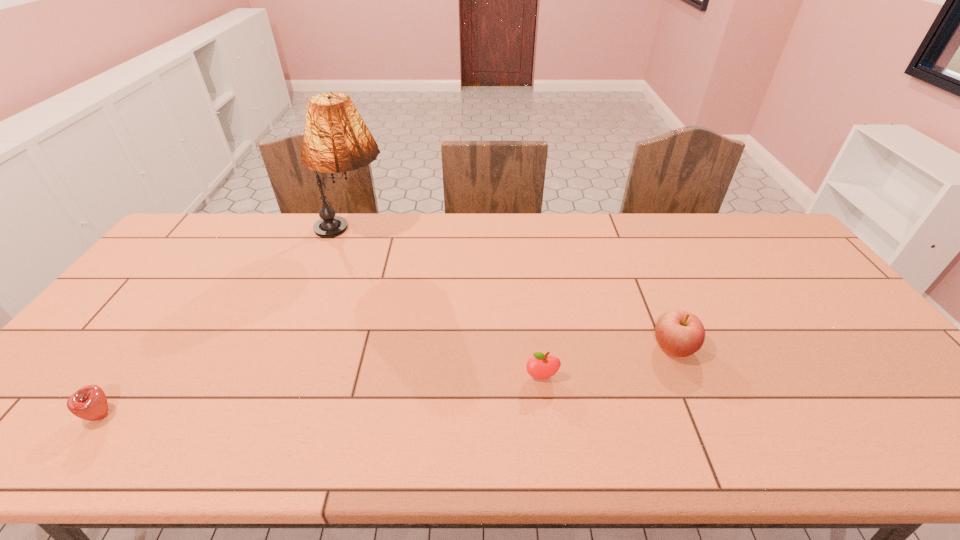
The width and height of the screenshot is (960, 540). I want to click on blank area located on the back of the second apple from left to right, so click(x=536, y=329).

I want to click on free space located on the back of the nearest object, so click(126, 381).

This screenshot has height=540, width=960. I want to click on object located in the far edge section of the desktop, so [336, 139].

I want to click on object located at the near edge, so click(90, 403).

The image size is (960, 540). What are the coordinates of `object present at the left edge` in the screenshot? It's located at (90, 403).

This screenshot has width=960, height=540. I want to click on object located at the near left corner, so click(x=90, y=403).

The height and width of the screenshot is (540, 960). I want to click on free space at the far edge of the desktop, so click(x=409, y=233).

Locate an element on the screen. This screenshot has width=960, height=540. vacant space at the near edge of the desktop is located at coordinates (722, 428).

This screenshot has width=960, height=540. In the image, there is a desktop. What are the coordinates of `vacant space at the left edge` in the screenshot? It's located at (139, 311).

Where is `free space at the right edge of the desktop`? The width and height of the screenshot is (960, 540). free space at the right edge of the desktop is located at coordinates (772, 269).